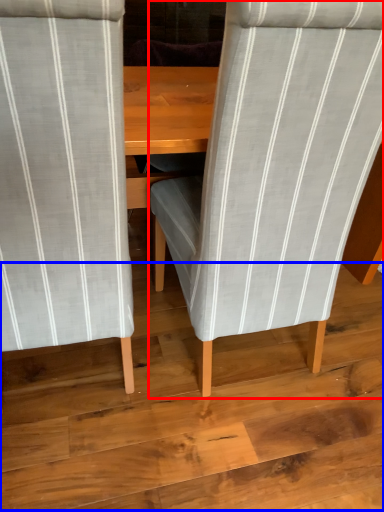
Question: Which object appears farthest to the camera in this image, chair (highlighted by a red box) or plywood (highlighted by a blue box)?

Choices:
 (A) chair
 (B) plywood

Answer: (B)